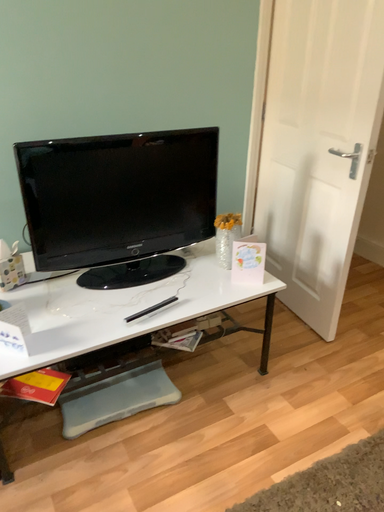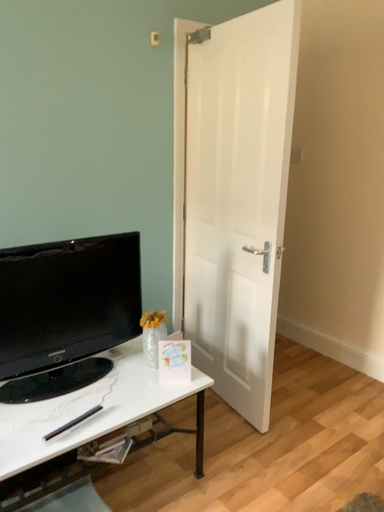
Question: Which way did the camera rotate in the video?

Choices:
 (A) rotated downward
 (B) rotated upward

Answer: (B)